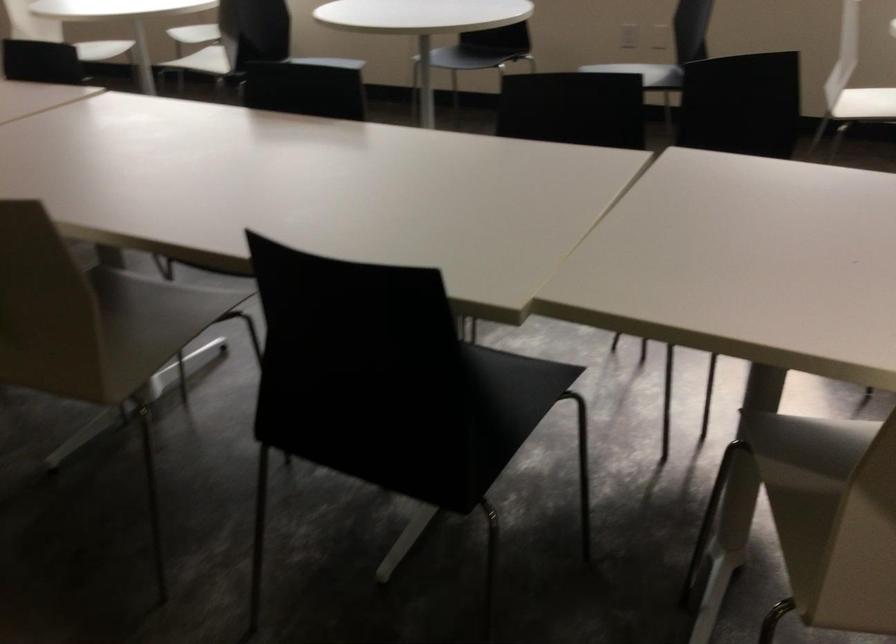
Describe the element at coordinates (159, 317) in the screenshot. I see `the white chair sitting surface` at that location.